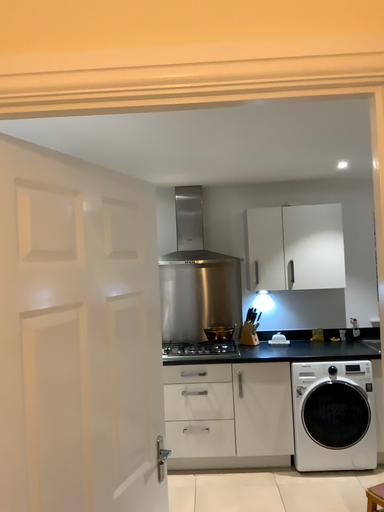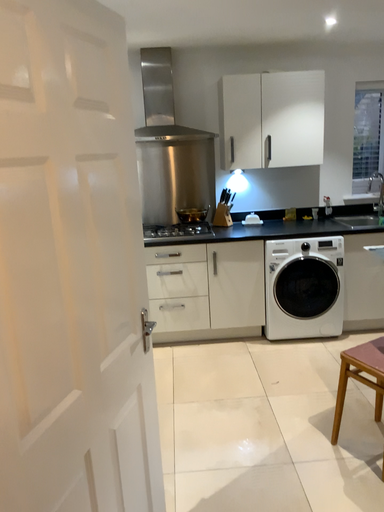
Question: Which way did the camera rotate in the video?

Choices:
 (A) rotated upward
 (B) rotated downward

Answer: (B)